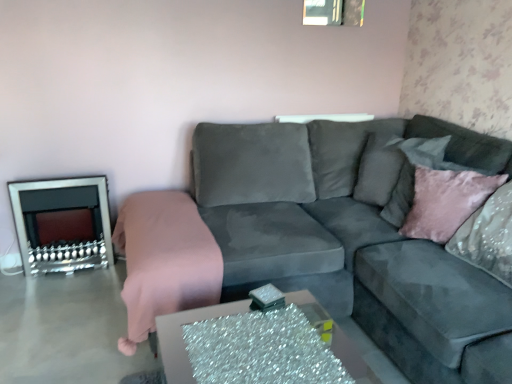
Question: Is velvet gray couch at center touching silver metallic fireplace at left?

Choices:
 (A) no
 (B) yes

Answer: (A)

Question: Does velvet gray couch at center have a larger size compared to silver metallic fireplace at left?

Choices:
 (A) yes
 (B) no

Answer: (A)

Question: From a real-world perspective, is velvet gray couch at center over silver metallic fireplace at left?

Choices:
 (A) yes
 (B) no

Answer: (A)

Question: Are velvet gray couch at center and silver metallic fireplace at left located far from each other?

Choices:
 (A) no
 (B) yes

Answer: (B)

Question: From the image's perspective, is velvet gray couch at center located beneath silver metallic fireplace at left?

Choices:
 (A) yes
 (B) no

Answer: (B)

Question: Is pink velvet blanket at left wider or thinner than velvet gray pillow at upper right?

Choices:
 (A) wide
 (B) thin

Answer: (A)

Question: Considering the relative positions of pink velvet blanket at left and velvet gray pillow at upper right in the image provided, is pink velvet blanket at left to the left or to the right of velvet gray pillow at upper right?

Choices:
 (A) left
 (B) right

Answer: (A)

Question: From the image's perspective, is pink velvet blanket at left above or below velvet gray pillow at upper right?

Choices:
 (A) above
 (B) below

Answer: (B)

Question: Considering the positions of pink velvet blanket at left and velvet gray pillow at upper right in the image, is pink velvet blanket at left bigger or smaller than velvet gray pillow at upper right?

Choices:
 (A) small
 (B) big

Answer: (B)

Question: Does point (147, 235) appear closer or farther from the camera than point (475, 183)?

Choices:
 (A) farther
 (B) closer

Answer: (A)

Question: Considering the relative positions of pink velvet blanket at left and pink velvet cushion at right in the image provided, is pink velvet blanket at left to the left or to the right of pink velvet cushion at right?

Choices:
 (A) left
 (B) right

Answer: (A)

Question: From the image's perspective, relative to pink velvet cushion at right, is pink velvet blanket at left above or below?

Choices:
 (A) below
 (B) above

Answer: (A)

Question: Is pink velvet blanket at left bigger or smaller than pink velvet cushion at right?

Choices:
 (A) small
 (B) big

Answer: (B)

Question: Which is correct: pink velvet cushion at right is inside pink velvet blanket at left, or outside of it?

Choices:
 (A) outside
 (B) inside

Answer: (A)

Question: Looking at their shapes, would you say pink velvet cushion at right is wider or thinner than pink velvet blanket at left?

Choices:
 (A) thin
 (B) wide

Answer: (A)